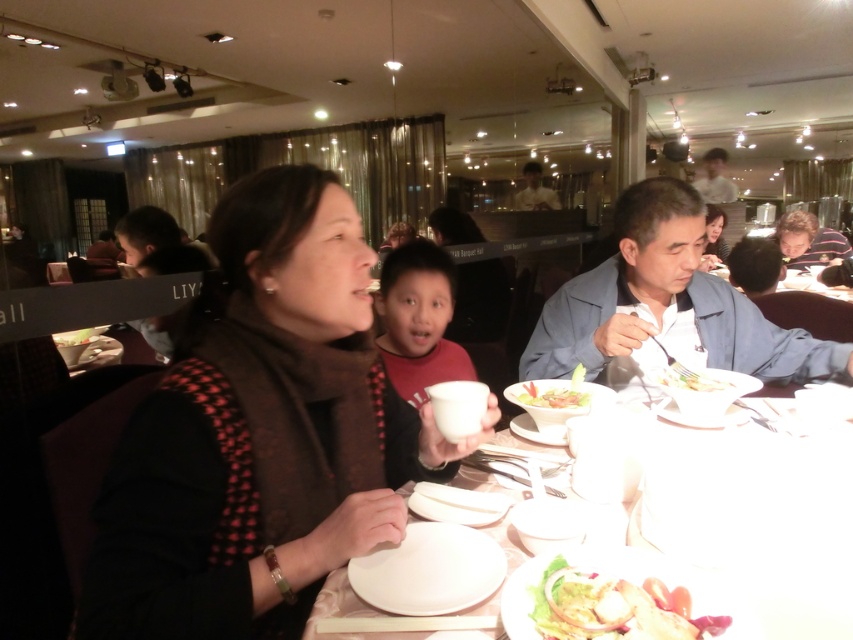
Consider the image. Does blue fabric shirt at center appear under white glossy salad bowl at center?

No.

Does point (581, 291) come farther from viewer compared to point (705, 376)?

Yes, point (581, 291) is farther from viewer.

What do you see at coordinates (666, 304) in the screenshot? I see `blue fabric shirt at center` at bounding box center [666, 304].

Locate an element on the screen. blue fabric shirt at center is located at coordinates (666, 304).

Which of these two, white glossy plate at center or matte red shirt at center, stands shorter?

With less height is white glossy plate at center.

Which is more to the right, white glossy plate at center or matte red shirt at center?

Positioned to the right is white glossy plate at center.

Which is behind, point (805, 538) or point (437, 356)?

The point (437, 356) is behind.

Find the location of a particular element. This screenshot has height=640, width=853. white glossy plate at center is located at coordinates [791, 528].

Is white glossy plate at center smaller than shiny green salad at center?

Incorrect, white glossy plate at center is not smaller in size than shiny green salad at center.

Is white glossy plate at center below shiny green salad at center?

Incorrect, white glossy plate at center is not positioned below shiny green salad at center.

Is point (560, 451) less distant than point (614, 618)?

No, (560, 451) is further to viewer.

I want to click on white glossy plate at center, so click(791, 528).